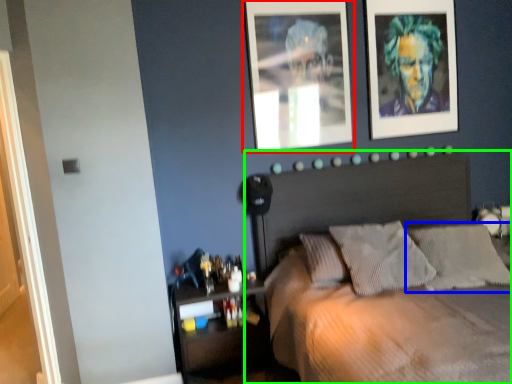
Question: Based on their relative distances, which object is farther from picture frame (highlighted by a red box)? Choose from pillow (highlighted by a blue box) and bed (highlighted by a green box).

Choices:
 (A) pillow
 (B) bed

Answer: (A)